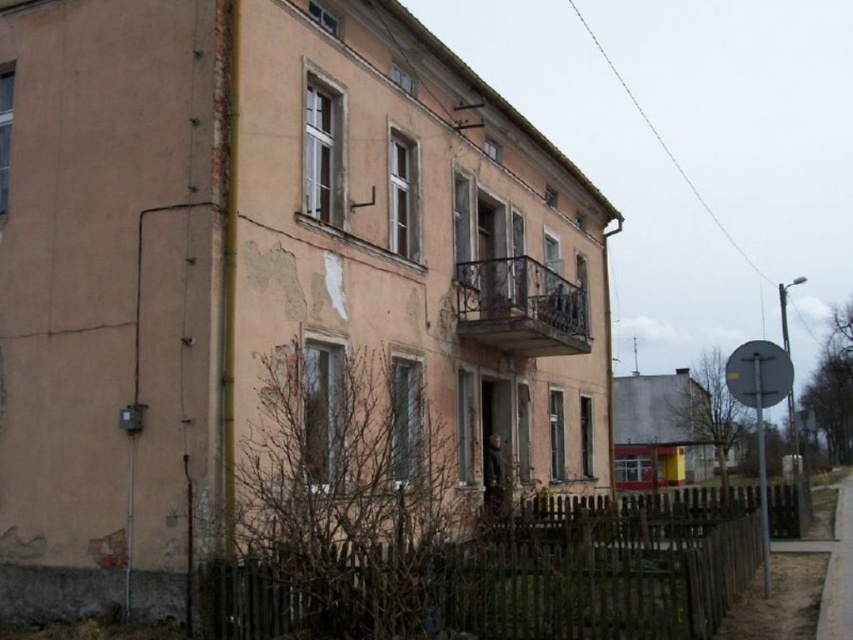
Question: Which of the following is the farthest from the observer?

Choices:
 (A) (764, 477)
 (B) (245, 612)
 (C) (523, 353)

Answer: (A)

Question: Which point is farther to the camera?

Choices:
 (A) (550, 353)
 (B) (724, 492)

Answer: (A)

Question: Does rusty metal balcony at center appear over silver metallic sign at right?

Choices:
 (A) no
 (B) yes

Answer: (B)

Question: From the image, what is the correct spatial relationship of brown wooden fence at lower center in relation to silver metallic sign at right?

Choices:
 (A) left
 (B) right

Answer: (A)

Question: Can you confirm if brown wooden fence at lower center is positioned above silver metallic sign at right?

Choices:
 (A) yes
 (B) no

Answer: (A)

Question: Which point is farther from the camera taking this photo?

Choices:
 (A) (480, 262)
 (B) (775, 397)
 (C) (781, 484)

Answer: (C)